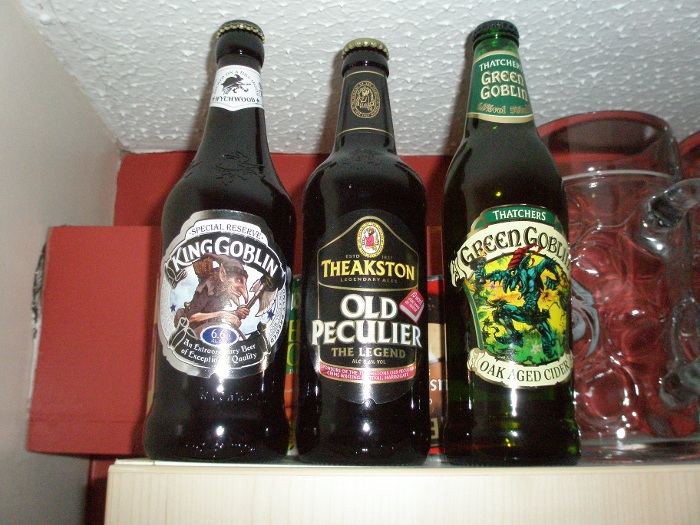
Where is `shelf`? shelf is located at coordinates (374, 465).